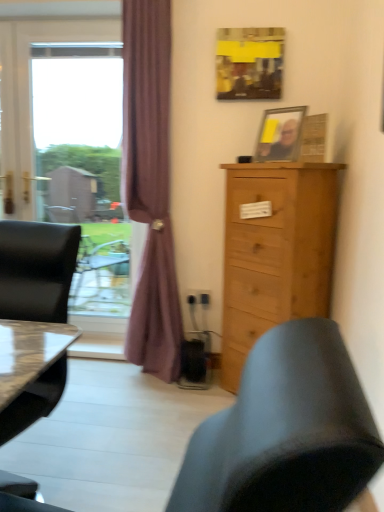
Question: From the image's perspective, is yellow paper at upper center, the 2th picture frame positioned from the bottom, positioned above or below wooden picture frame at upper right, which ranks as the second picture frame in top-to-bottom order?

Choices:
 (A) below
 (B) above

Answer: (B)

Question: Considering their positions, is yellow paper at upper center, acting as the first picture frame starting from the top, located in front of or behind wooden picture frame at upper right, arranged as the 1th picture frame when ordered from the bottom?

Choices:
 (A) behind
 (B) front

Answer: (A)

Question: Which is farther from the yellow paper at upper center, acting as the first picture frame starting from the top?

Choices:
 (A) wooden picture frame at upper right, which ranks as the second picture frame in top-to-bottom order
 (B) transparent glass window at left
 (C) purple fabric curtain at left
 (D) natural wood cabinet at right
 (E) matte black chair at left

Answer: (E)

Question: Which is farther from the purple fabric curtain at left?

Choices:
 (A) transparent glass window at left
 (B) matte black chair at left
 (C) wooden picture frame at upper right, which ranks as the second picture frame in top-to-bottom order
 (D) natural wood cabinet at right
 (E) yellow paper at upper center, the 2th picture frame positioned from the bottom

Answer: (B)